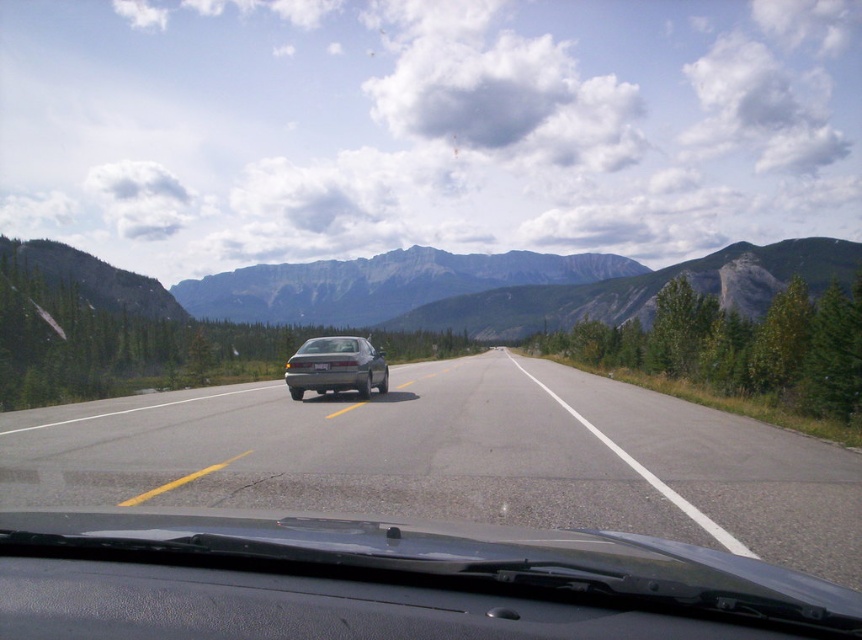
You are driving a car and see the image ahead. There is a gray asphalt highway at center and a matte gray car at center. Which object is closer to you?

The gray asphalt highway at center is closer to the viewer than the matte gray car at center.

You are a driver in a vehicle and see the satin silver sedan at center and the matte gray car at center ahead on the road. Which vehicle should you be cautious about overtaking due to its size?

The satin silver sedan at center is bigger than the matte gray car at center, so you should be cautious about overtaking the satin silver sedan at center because it has a larger size which might require more space and attention while passing.

Based on the photo, you are driving a car and see the satin silver sedan at center and the matte gray car at center ahead on the road. Which car is closer to you?

The satin silver sedan at center is positioned under the matte gray car at center, which means it is closer to you.